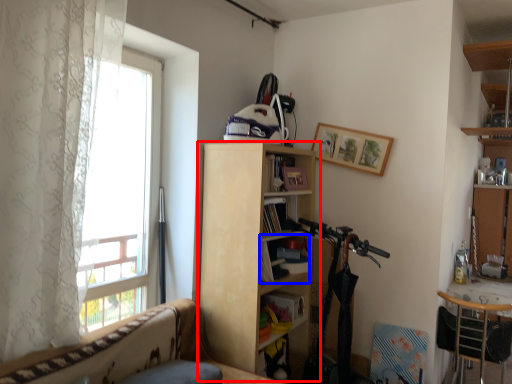
Question: Which object appears closest to the camera in this image, bookcase (highlighted by a red box) or book (highlighted by a blue box)?

Choices:
 (A) bookcase
 (B) book

Answer: (A)